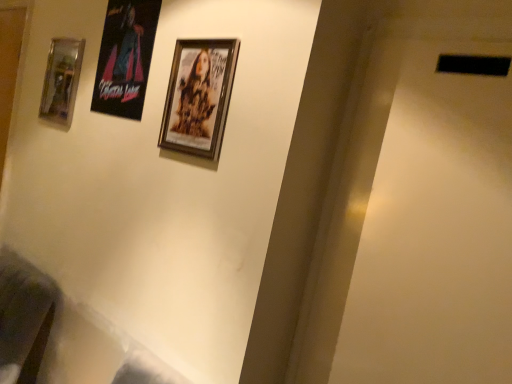
Question: Does wooden framed poster at center, the second picture frame in the back-to-front sequence, appear on the right side of metallic glass picture frame at left, which appears as the 2th picture frame when viewed from the right?

Choices:
 (A) no
 (B) yes

Answer: (B)

Question: Considering the relative sizes of wooden framed poster at center, the second picture frame in the back-to-front sequence, and metallic glass picture frame at left, which appears as the 2th picture frame when viewed from the right, in the image provided, is wooden framed poster at center, the second picture frame in the back-to-front sequence, smaller than metallic glass picture frame at left, which appears as the 2th picture frame when viewed from the right,?

Choices:
 (A) no
 (B) yes

Answer: (B)

Question: Is wooden framed poster at center, the 1th picture frame viewed from the right, wider than metallic glass picture frame at left, placed as the first picture frame when sorted from back to front?

Choices:
 (A) no
 (B) yes

Answer: (A)

Question: Considering the relative sizes of wooden framed poster at center, arranged as the second picture frame when viewed from the left, and metallic glass picture frame at left, which appears as the 2th picture frame when viewed from the right, in the image provided, is wooden framed poster at center, arranged as the second picture frame when viewed from the left, bigger than metallic glass picture frame at left, which appears as the 2th picture frame when viewed from the right,?

Choices:
 (A) yes
 (B) no

Answer: (B)

Question: From the image's perspective, is wooden framed poster at center, the 1th picture frame viewed from the right, on metallic glass picture frame at left, placed as the first picture frame when sorted from back to front?

Choices:
 (A) yes
 (B) no

Answer: (B)

Question: Is wooden framed poster at center, which ranks as the first picture frame in front-to-back order, thinner than metallic glass picture frame at left, which appears as the 2th picture frame when viewed from the right?

Choices:
 (A) no
 (B) yes

Answer: (B)

Question: Would you say metallic glass picture frame at left, the second picture frame from the front, contains wooden framed poster at center, which ranks as the first picture frame in front-to-back order?

Choices:
 (A) no
 (B) yes

Answer: (A)

Question: From the image's perspective, would you say metallic glass picture frame at left, acting as the first picture frame starting from the left, is shown under wooden framed poster at center, which ranks as the first picture frame in front-to-back order?

Choices:
 (A) no
 (B) yes

Answer: (A)

Question: Considering the relative sizes of metallic glass picture frame at left, which appears as the 2th picture frame when viewed from the right, and wooden framed poster at center, which ranks as the first picture frame in front-to-back order, in the image provided, is metallic glass picture frame at left, which appears as the 2th picture frame when viewed from the right, smaller than wooden framed poster at center, which ranks as the first picture frame in front-to-back order,?

Choices:
 (A) no
 (B) yes

Answer: (A)

Question: Is metallic glass picture frame at left, which appears as the 2th picture frame when viewed from the right, outside wooden framed poster at center, which ranks as the first picture frame in front-to-back order?

Choices:
 (A) no
 (B) yes

Answer: (B)

Question: Is metallic glass picture frame at left, which appears as the 2th picture frame when viewed from the right, thinner than wooden framed poster at center, the second picture frame in the back-to-front sequence?

Choices:
 (A) no
 (B) yes

Answer: (A)

Question: Is metallic glass picture frame at left, the second picture frame from the front, oriented away from wooden framed poster at center, the 1th picture frame viewed from the right?

Choices:
 (A) no
 (B) yes

Answer: (A)

Question: Is wooden framed poster at center, arranged as the second picture frame when viewed from the left, inside the boundaries of metallic glass picture frame at left, the second picture frame from the front, or outside?

Choices:
 (A) inside
 (B) outside

Answer: (B)